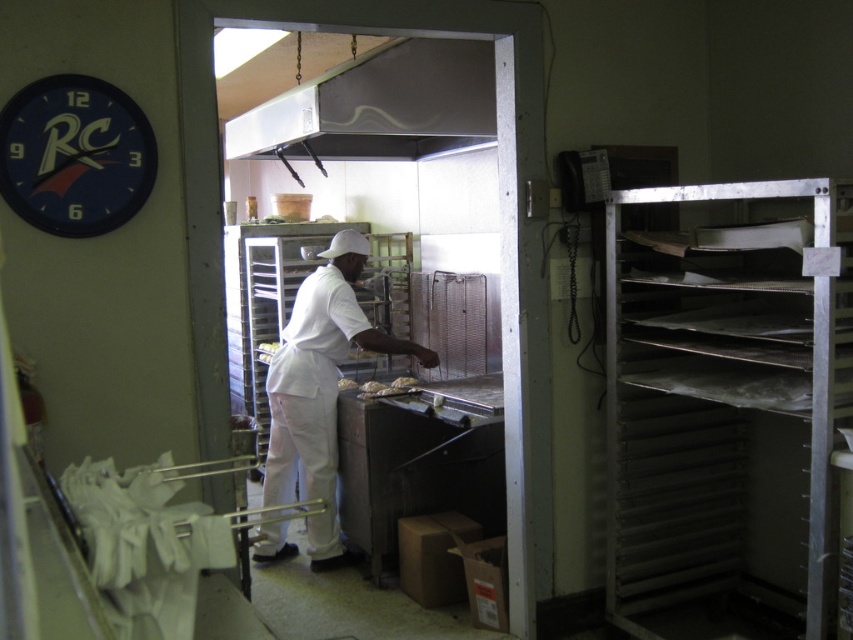
Question: Is metallic silver tray rack at right to the right of metallic at upper center from the viewer's perspective?

Choices:
 (A) yes
 (B) no

Answer: (A)

Question: Can you confirm if white matte uniform at center is positioned to the right of golden brown bread at center?

Choices:
 (A) no
 (B) yes

Answer: (B)

Question: Considering the real-world distances, which object is farthest from the golden brown pastry at center?

Choices:
 (A) golden brown bread at center
 (B) white matte bread at center
 (C) blue plastic clock at upper left

Answer: (C)

Question: Which object is farther from the camera taking this photo?

Choices:
 (A) blue plastic clock at upper left
 (B) golden brown bread at center
 (C) white matte bread at center

Answer: (C)

Question: Observing the image, what is the correct spatial positioning of metallic at upper center in reference to white matte bread at center?

Choices:
 (A) left
 (B) right

Answer: (B)

Question: Among these objects, which one is nearest to the camera?

Choices:
 (A) blue plastic clock at upper left
 (B) metallic silver tray rack at right
 (C) golden brown pastry at center

Answer: (A)